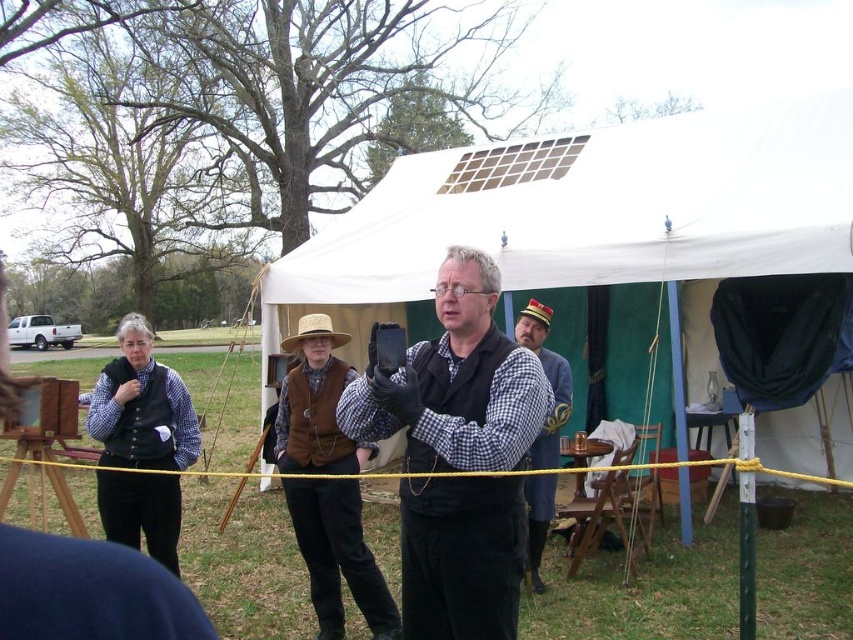
Question: Is white canvas tent at center wider than matte black vest at center?

Choices:
 (A) yes
 (B) no

Answer: (B)

Question: Which of the following is the closest to the observer?

Choices:
 (A) brown leather hat at center
 (B) matte black vest at center
 (C) white canvas tent at center

Answer: (B)

Question: Does matte black vest at center have a larger size compared to brown leather hat at center?

Choices:
 (A) yes
 (B) no

Answer: (B)

Question: Which of the following is the farthest from the observer?

Choices:
 (A) matte black vest at left
 (B) brown straw cowboy hat at center

Answer: (B)

Question: Can you confirm if matte black vest at center is positioned above matte black vest at left?

Choices:
 (A) yes
 (B) no

Answer: (A)

Question: Which point is farther from the camera taking this photo?

Choices:
 (A) (428, 397)
 (B) (550, 314)
 (C) (149, 390)

Answer: (B)